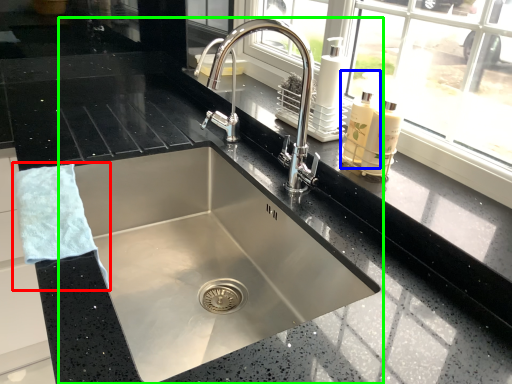
Question: Which is farther away from hand towel (highlighted by a red box)? soap dispenser (highlighted by a blue box) or sink (highlighted by a green box)?

Choices:
 (A) soap dispenser
 (B) sink

Answer: (A)